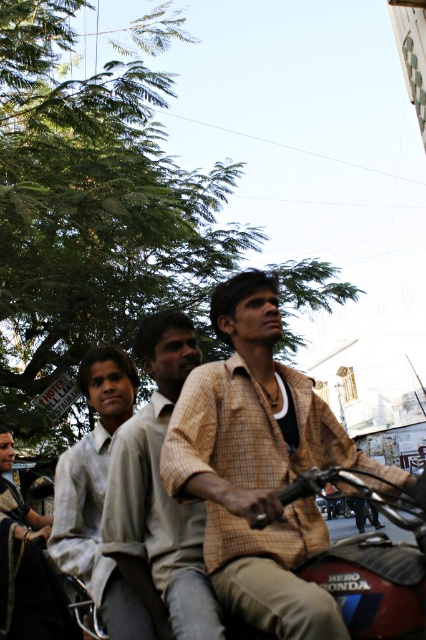
Based on the scene description, can you determine the spatial relationship between the light brown checkered shirt at center and the dark green fabric sari at lower left?

The light brown checkered shirt at center is to the right of the dark green fabric sari at lower left.

You are a pedestrian standing on the sidewalk and see the light brown checkered shirt at center and the light gray shirt at left. Which one is higher from the ground?

The light brown checkered shirt at center is above the light gray shirt at left, so it is higher from the ground.

You are a clothing designer observing the scene. You need to create a new line of shirts that accommodate different body types. Which shirt from the scene, the light brown checkered shirt at center or the light gray shirt at left, would you use as a reference for a plus size collection?

The light gray shirt at left is thicker than the light brown checkered shirt at center, so the light gray shirt at left would be better for a plus size collection.